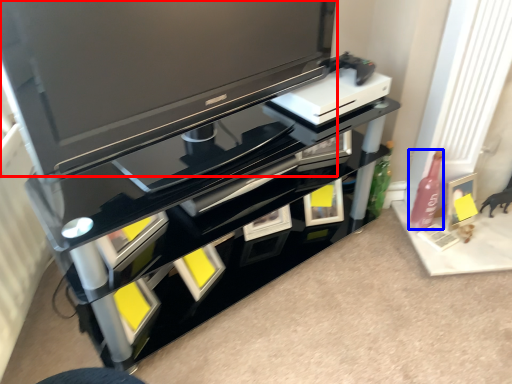
Question: Which object appears farthest to the camera in this image, television (highlighted by a red box) or bottle (highlighted by a blue box)?

Choices:
 (A) television
 (B) bottle

Answer: (B)